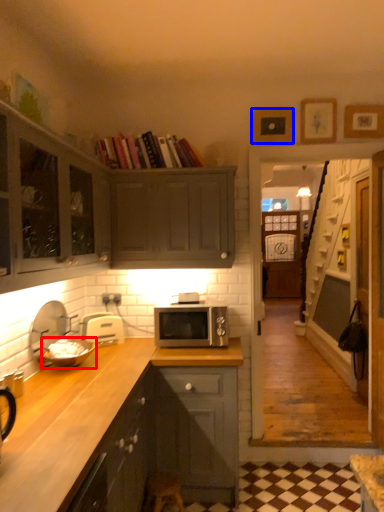
Question: Which object is further to the camera taking this photo, appliance (highlighted by a red box) or picture frame (highlighted by a blue box)?

Choices:
 (A) appliance
 (B) picture frame

Answer: (B)